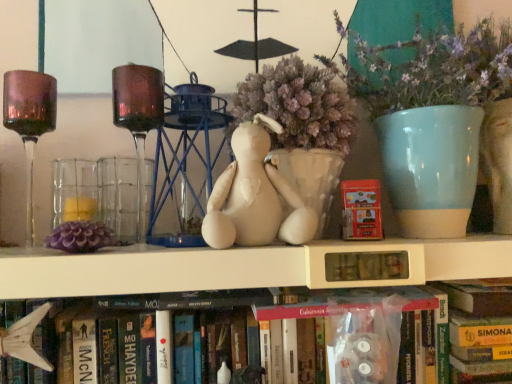
Question: From the image's perspective, relative to matte red paperback book at center, is white matte shelf at center above or below?

Choices:
 (A) below
 (B) above

Answer: (A)

Question: Visually, is white matte shelf at center positioned to the left or to the right of matte red paperback book at center?

Choices:
 (A) right
 (B) left

Answer: (B)

Question: Which of these objects is positioned farthest from the white matte shelf at center?

Choices:
 (A) translucent glass candle holder at left
 (B) matte ceramic vase at upper right
 (C) matte red paperback book at center
 (D) hardcover book at lower center, the first book in the right-to-left sequence
 (E) amber glass wine glass at left

Answer: (E)

Question: Considering the real-world distances, which object is farthest from the amber glass wine glass at left?

Choices:
 (A) hardcover book at lower center, the 2th book from the left
 (B) white matte shelf at center
 (C) matte ceramic vase at upper right
 (D) white fabric stuffed animal at center
 (E) hardcover book at center, the 1th book positioned from the left

Answer: (A)